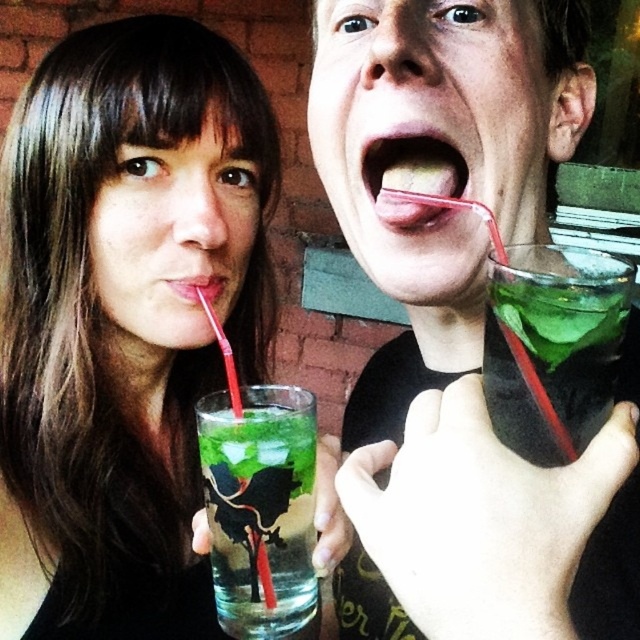
Does green translucent glass at center have a smaller size compared to matte pink lips at center?

Incorrect, green translucent glass at center is not smaller in size than matte pink lips at center.

Between green translucent glass at center and matte pink lips at center, which one is positioned higher?

Positioned higher is matte pink lips at center.

Which is behind, point (307, 452) or point (193, 301)?

The point (193, 301) is more distant.

Where is `green translucent glass at center`? green translucent glass at center is located at coordinates (259, 502).

Does green translucent glass at mouth appear under green matte tongue at center?

Indeed, green translucent glass at mouth is positioned under green matte tongue at center.

Is green translucent glass at mouth to the right of green matte tongue at center from the viewer's perspective?

Indeed, green translucent glass at mouth is positioned on the right side of green matte tongue at center.

In the scene shown: Who is more distant from viewer, (525, 259) or (426, 227)?

Point (426, 227)

You are a GUI agent. You are given a task and a screenshot of the screen. Output one action in this format:
    pyautogui.click(x=<x>, y=<y>)
    Task: Click on the green translucent glass at mouth
    
    Given the screenshot: What is the action you would take?
    pyautogui.click(x=547, y=339)

How much distance is there between green translucent glass at center and green matte tongue at center?

A distance of 7.54 inches exists between green translucent glass at center and green matte tongue at center.

Between green translucent glass at center and green matte tongue at center, which one is positioned higher?

green matte tongue at center is higher up.

Describe the element at coordinates (259, 502) in the screenshot. I see `green translucent glass at center` at that location.

Find the location of a particular element. The height and width of the screenshot is (640, 640). green translucent glass at center is located at coordinates click(259, 502).